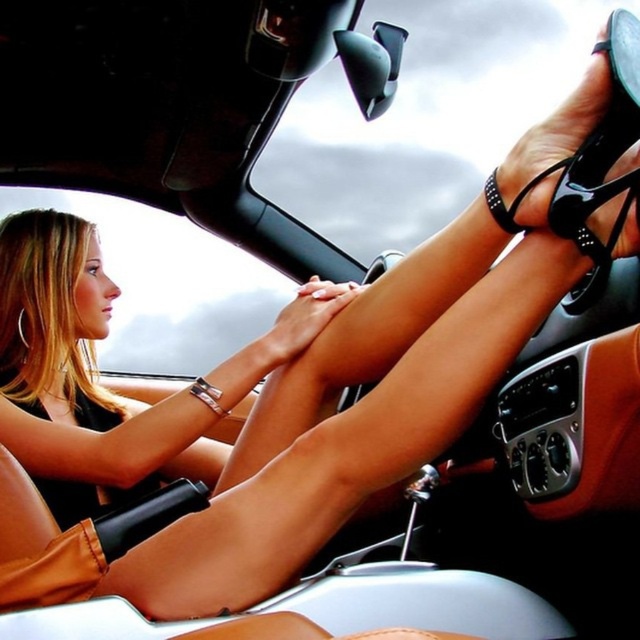
Question: Can you confirm if smooth skin legs at center is smaller than black glossy shoe at center?

Choices:
 (A) yes
 (B) no

Answer: (B)

Question: Which object is farther from the camera taking this photo?

Choices:
 (A) black glossy shoe at center
 (B) smooth skin legs at center

Answer: (B)

Question: Considering the relative positions of smooth skin legs at center and black glossy shoe at center in the image provided, where is smooth skin legs at center located with respect to black glossy shoe at center?

Choices:
 (A) below
 (B) above

Answer: (A)

Question: Observing the image, what is the correct spatial positioning of smooth skin legs at center in reference to black glossy shoe at center?

Choices:
 (A) below
 (B) above

Answer: (A)

Question: Which object is farther from the camera taking this photo?

Choices:
 (A) smooth skin legs at center
 (B) black glossy shoe at center

Answer: (A)

Question: Which of the following is the farthest from the observer?

Choices:
 (A) smooth skin legs at center
 (B) black glossy shoe at center

Answer: (A)